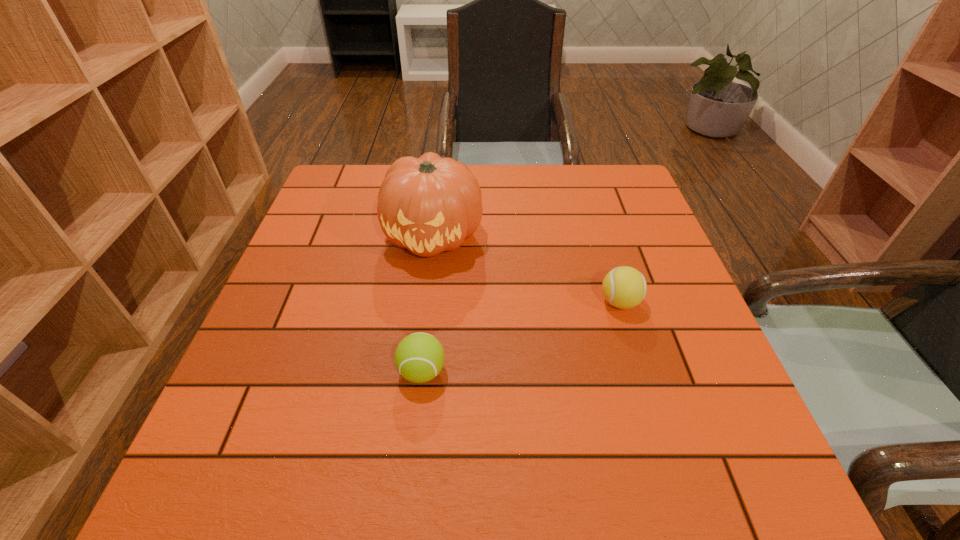
The image size is (960, 540). I want to click on pumpkin, so click(430, 204).

The height and width of the screenshot is (540, 960). Identify the location of the farthest object. (430, 204).

Identify the location of the farther tennis ball. (624, 287).

The width and height of the screenshot is (960, 540). In order to click on the second farthest object in this screenshot , I will do `click(624, 287)`.

Locate an element on the screen. the left tennis ball is located at coordinates (419, 357).

Image resolution: width=960 pixels, height=540 pixels. In order to click on the nearer tennis ball in this screenshot , I will do `click(419, 357)`.

Identify the location of free space located on the carved face of the farthest object. (413, 409).

The image size is (960, 540). In order to click on free space located 0.280m on the front of the farther tennis ball in this screenshot , I will do `click(664, 446)`.

This screenshot has width=960, height=540. I want to click on vacant area located on the left of the nearest object, so click(346, 372).

In order to click on object that is at the far edge in this screenshot , I will do `click(430, 204)`.